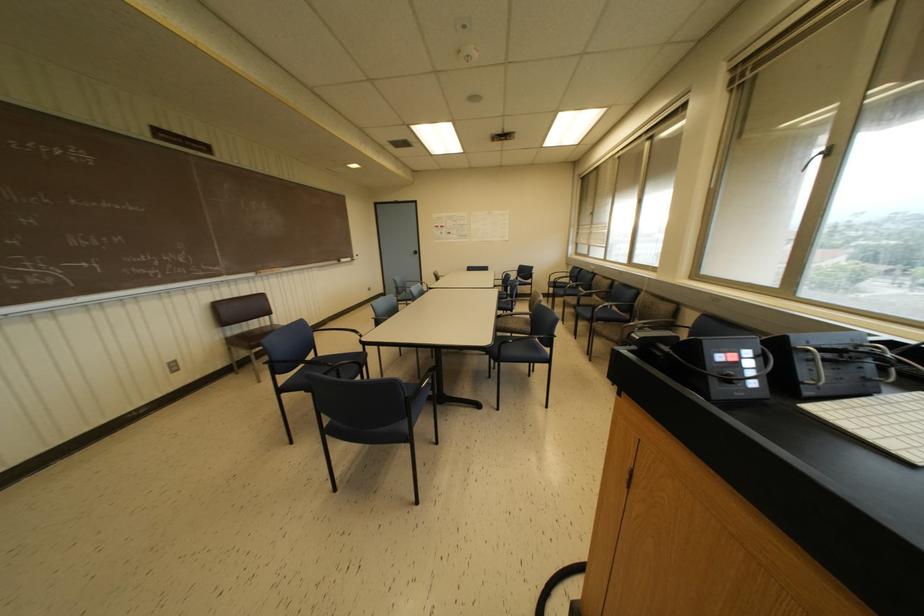
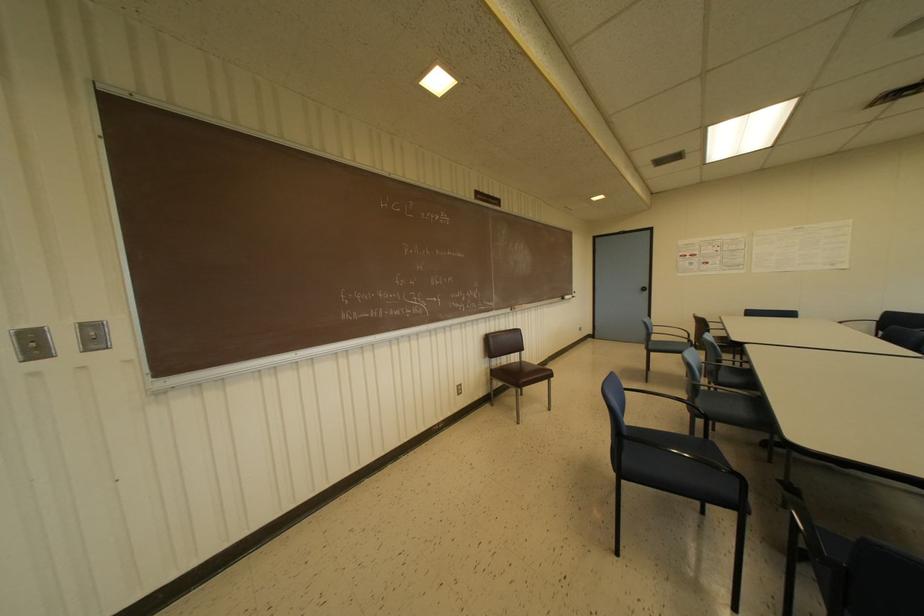
Find the pixel in the second image that matches (366,353) in the first image.

(713, 443)